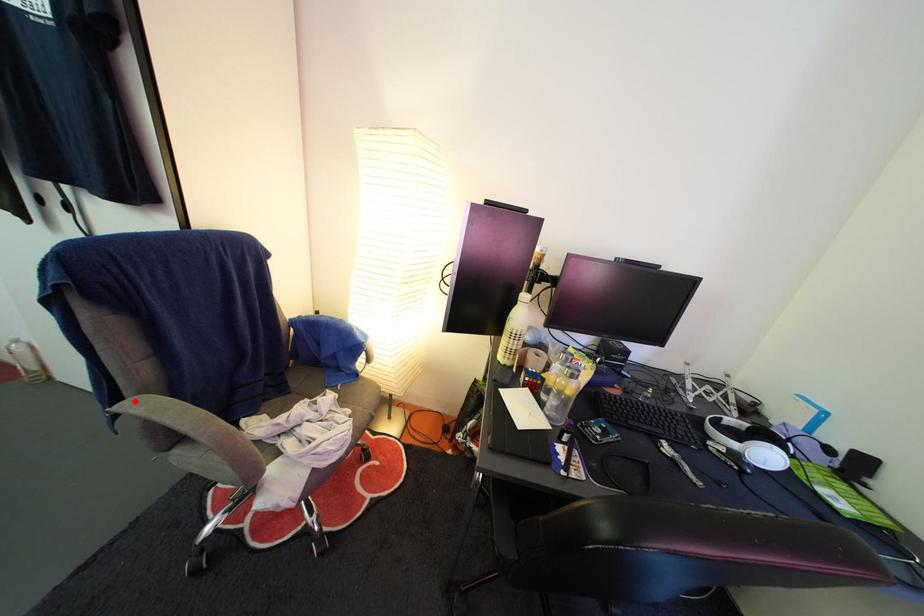
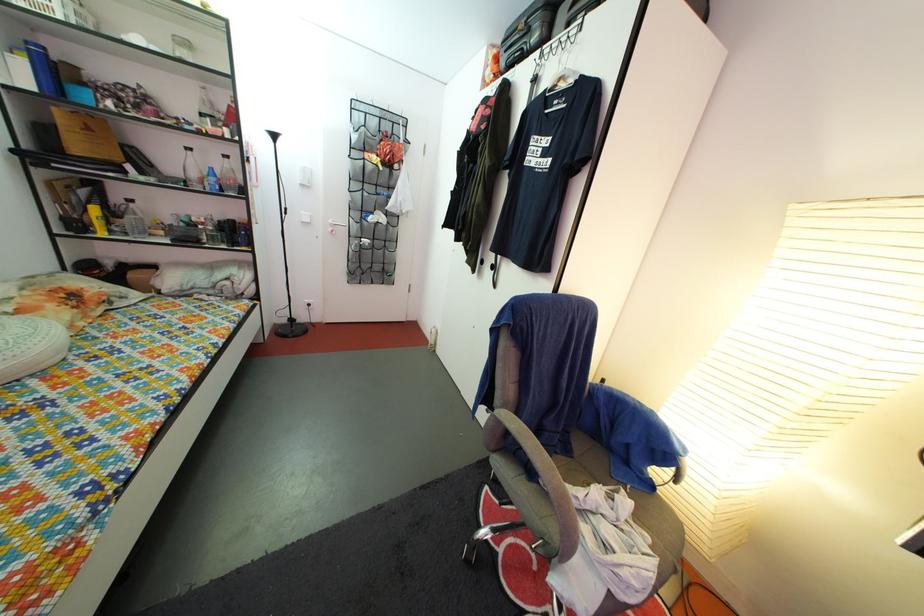
Where in the second image is the point corresponding to the highlighted location from the first image?

(505, 410)